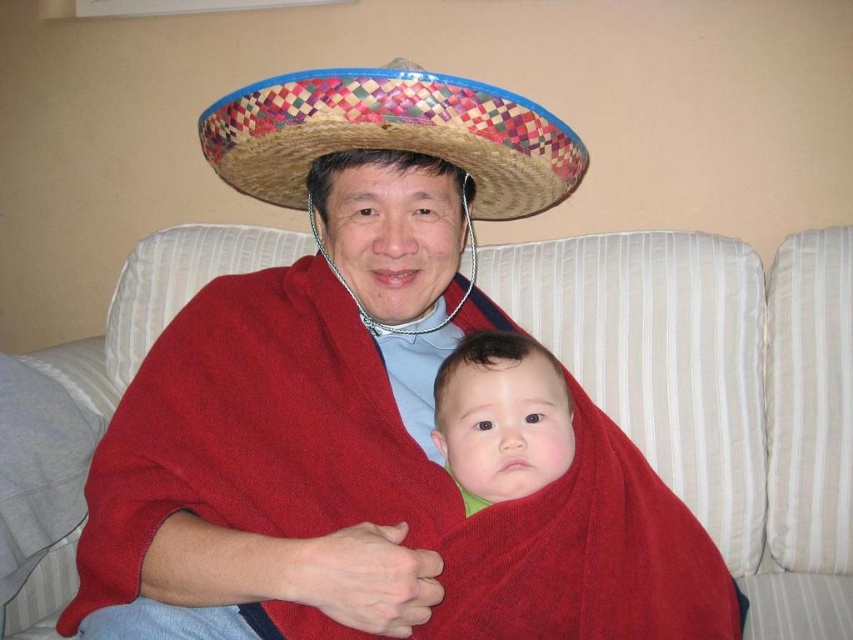
You are designing a living room layout and need to place a small table between the white striped couch at center and the woven straw sombrero at center. Can you fit the table there?

The white striped couch at center is bigger than the woven straw sombrero at center, so there is enough space between them to place a small table.

You are designing a storage box that needs to fit both the white striped couch at center and the woven straw sombrero at center. Which one requires a taller storage box?

The white striped couch at center requires a taller storage box because it is taller than the woven straw sombrero at center.

You are an interior designer assessing the placement of two decorative points in a living room. The points are labeled as point (573, 339) and point (267, 109). Which of these two points is closer to the viewer?

Point (573, 339) is further to the viewer than point (267, 109), so the point closer to the viewer is point (267, 109).